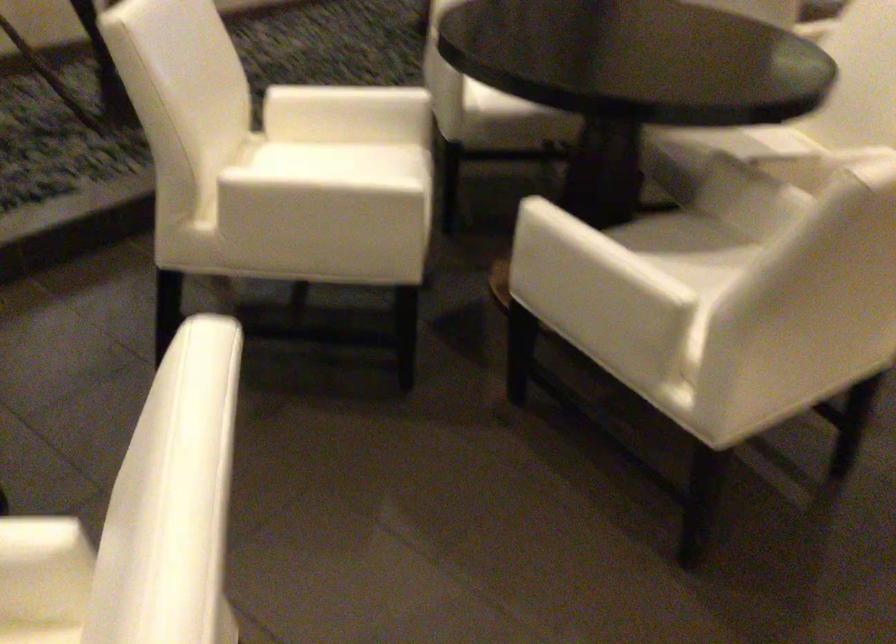
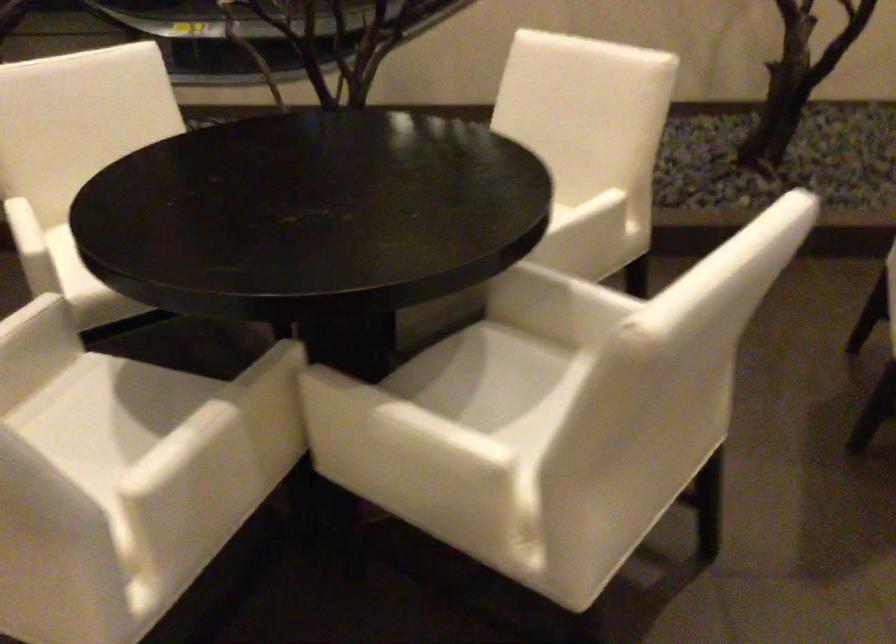
Where in the second image is the point corresponding to (759,147) from the first image?

(504, 393)